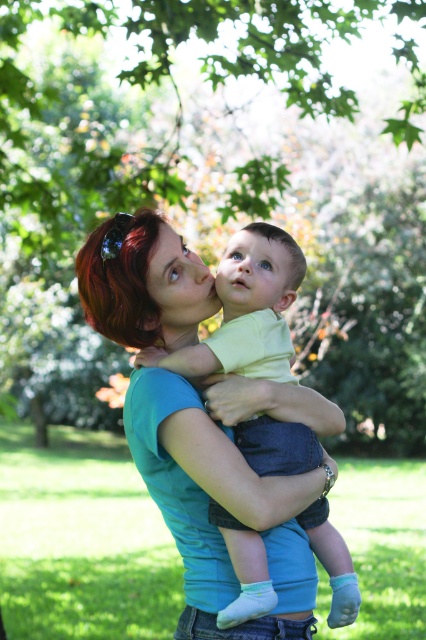
Question: Is light yellow fabric baby at center in front of blue smooth forehead at center?

Choices:
 (A) no
 (B) yes

Answer: (B)

Question: Based on their relative distances, which object is nearer to the blue smooth forehead at center?

Choices:
 (A) light yellow fabric baby at center
 (B) matte skin face at center
 (C) blue smooth baby at center
 (D) green leafy tree at upper center

Answer: (C)

Question: Is green leafy tree at upper center to the right of blue smooth baby at center from the viewer's perspective?

Choices:
 (A) no
 (B) yes

Answer: (A)

Question: Estimate the real-world distances between objects in this image. Which object is closer to the blue smooth baby at center?

Choices:
 (A) matte skin face at center
 (B) green leafy tree at upper center
 (C) blue smooth forehead at center
 (D) light yellow fabric baby at center

Answer: (A)

Question: Does green leafy tree at upper center appear over light yellow fabric baby at center?

Choices:
 (A) no
 (B) yes

Answer: (B)

Question: Which object appears farthest from the camera in this image?

Choices:
 (A) green leafy tree at upper center
 (B) blue smooth forehead at center

Answer: (A)